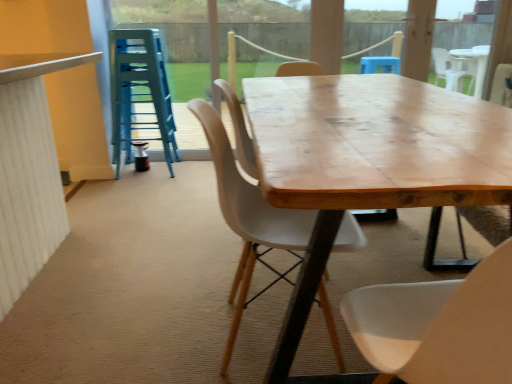
Question: Is transparent glass door at upper center inside or outside of wooden chair at center?

Choices:
 (A) outside
 (B) inside

Answer: (A)

Question: Is point (298, 52) positioned closer to the camera than point (262, 221)?

Choices:
 (A) farther
 (B) closer

Answer: (A)

Question: Estimate the real-world distances between objects in this image. Which object is closer to the wooden table at center?

Choices:
 (A) blue plastic stool at left
 (B) wooden chair at center
 (C) transparent glass door at upper center

Answer: (B)

Question: Estimate the real-world distances between objects in this image. Which object is closer to the transparent glass door at upper center?

Choices:
 (A) wooden chair at center
 (B) wooden table at center
 (C) blue plastic stool at left

Answer: (C)